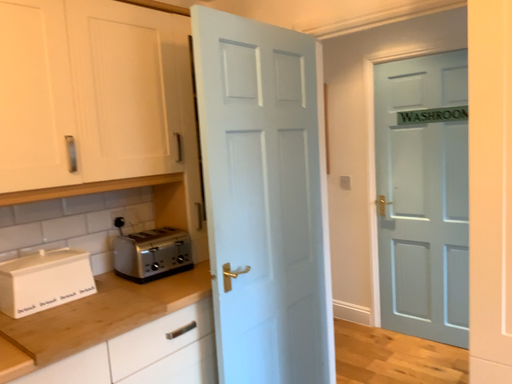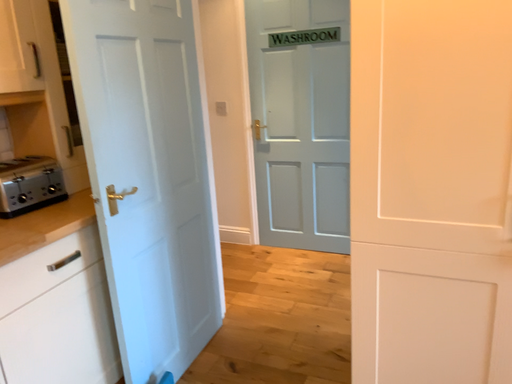
Question: Which way did the camera rotate in the video?

Choices:
 (A) rotated right
 (B) rotated left

Answer: (A)